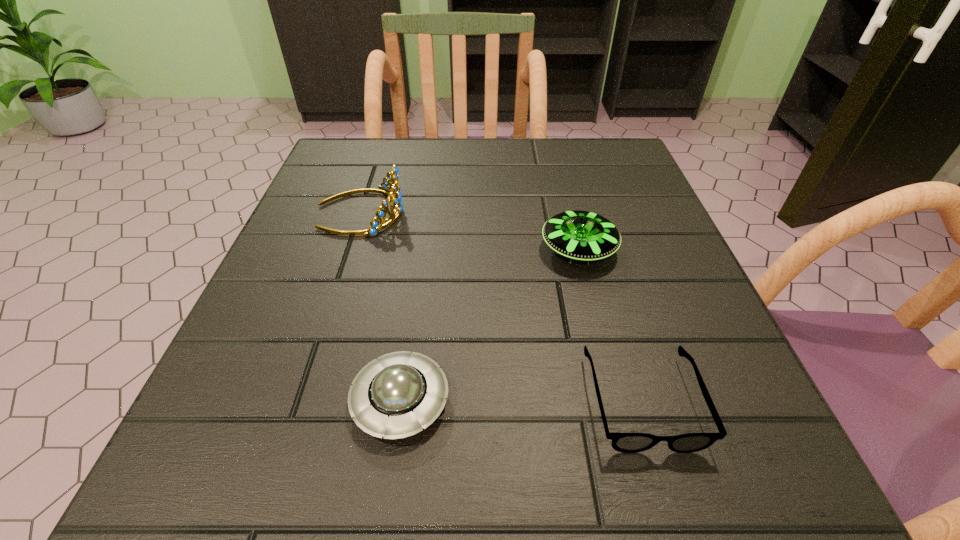
In order to click on saucer at the near edge in this screenshot , I will do `click(394, 396)`.

Find the location of a particular element. The width and height of the screenshot is (960, 540). spectacles positioned at the near edge is located at coordinates (623, 442).

Find the location of a particular element. object that is at the left edge is located at coordinates (392, 177).

Identify the location of saucer that is at the right edge. Image resolution: width=960 pixels, height=540 pixels. (580, 235).

Find the location of `spectacles that is at the right edge`. spectacles that is at the right edge is located at coordinates (623, 442).

You are a GUI agent. You are given a task and a screenshot of the screen. Output one action in this format:
    pyautogui.click(x=<x>, y=<y>)
    Task: Click on the object at the far left corner
    
    Given the screenshot: What is the action you would take?
    pyautogui.click(x=392, y=177)

The image size is (960, 540). I want to click on object that is at the near right corner, so [x=623, y=442].

In the image, there is a desktop. In order to click on vacant space at the far edge in this screenshot , I will do `click(550, 153)`.

Identify the location of vacant space at the near edge of the desktop. (412, 437).

Where is `vacant space at the left edge of the desktop`? This screenshot has width=960, height=540. vacant space at the left edge of the desktop is located at coordinates (325, 354).